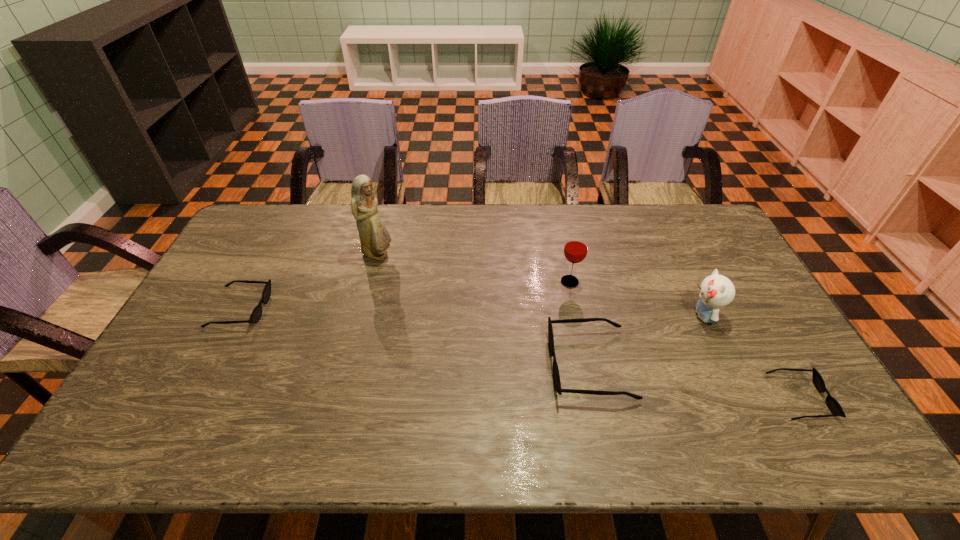
Where is `free space between the glass and the fourth tallest object`? Image resolution: width=960 pixels, height=540 pixels. free space between the glass and the fourth tallest object is located at coordinates (580, 323).

Locate an element on the screen. This screenshot has width=960, height=540. vacant space that's between the third shortest object and the fifth object from right to left is located at coordinates (484, 310).

What are the coordinates of `empty space that is in between the farthest object and the shortest object` in the screenshot? It's located at (588, 327).

Where is `unoccupied area between the rightmost sunglasses and the fifth tallest object`? The height and width of the screenshot is (540, 960). unoccupied area between the rightmost sunglasses and the fifth tallest object is located at coordinates (519, 353).

The image size is (960, 540). Find the location of `vacant space that's between the second sunglasses from left to right and the kitten`. vacant space that's between the second sunglasses from left to right and the kitten is located at coordinates (647, 340).

Where is `vacant space that's between the figurine and the tallest sunglasses`? The width and height of the screenshot is (960, 540). vacant space that's between the figurine and the tallest sunglasses is located at coordinates (484, 310).

The height and width of the screenshot is (540, 960). I want to click on free spot between the fifth tallest object and the glass, so click(x=405, y=295).

This screenshot has width=960, height=540. I want to click on free space that is in between the second sunglasses from left to right and the glass, so (580, 323).

Identify the location of object that is the second closest to the kitten. Image resolution: width=960 pixels, height=540 pixels. (556, 376).

Where is `object that stands as the fifth closest to the shortest sunglasses`? The height and width of the screenshot is (540, 960). object that stands as the fifth closest to the shortest sunglasses is located at coordinates (256, 314).